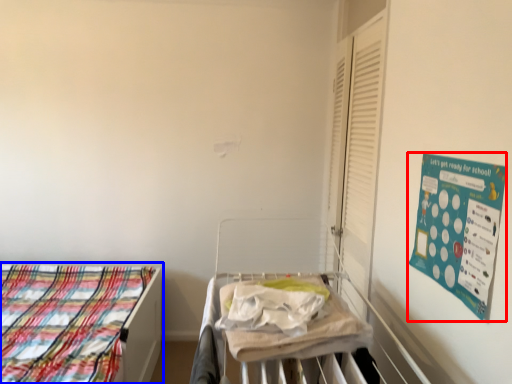
Question: Which of the following is the closest to the observer, poster (highlighted by a red box) or bed (highlighted by a blue box)?

Choices:
 (A) poster
 (B) bed

Answer: (A)